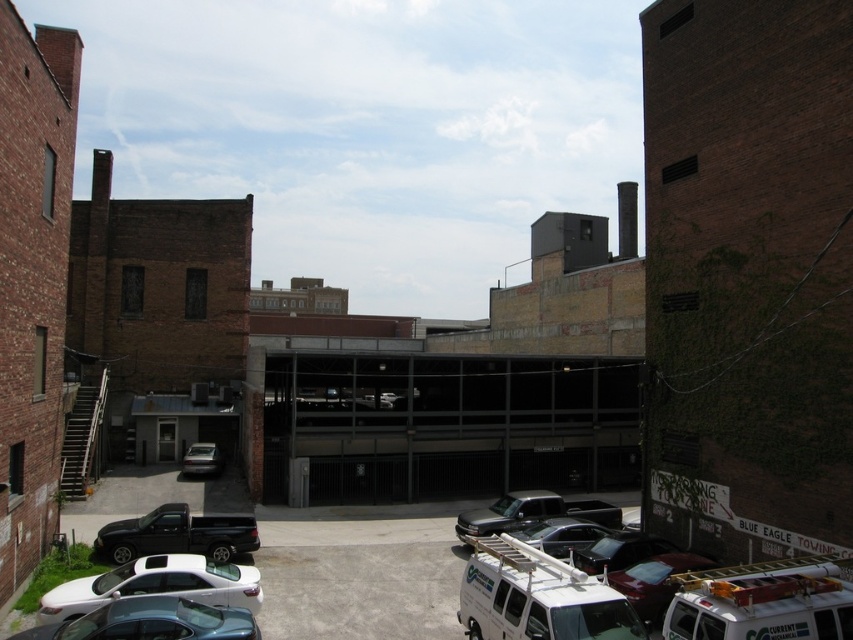
Question: Which object appears closest to the camera in this image?

Choices:
 (A) matte black truck at center
 (B) shiny black car at center
 (C) white matte sedan at lower left
 (D) white plastic ladder at lower right

Answer: (D)

Question: Can you confirm if teal glossy sedan at lower left is positioned below metallic silver car at center?

Choices:
 (A) no
 (B) yes

Answer: (A)

Question: Is dark gray concrete parking garage at center to the right of shiny black car at center from the viewer's perspective?

Choices:
 (A) no
 (B) yes

Answer: (A)

Question: Which object is positioned farthest from the dark gray concrete parking garage at center?

Choices:
 (A) metallic silver car at center
 (B) shiny black truck at lower left
 (C) white matte sedan at lower left

Answer: (C)

Question: Estimate the real-world distances between objects in this image. Which object is closer to the shiny black car at center?

Choices:
 (A) dark gray concrete parking garage at center
 (B) shiny black truck at lower left
 (C) white matte sedan at lower left

Answer: (C)

Question: Can you confirm if white matte sedan at lower left is positioned to the left of shiny black car at center?

Choices:
 (A) yes
 (B) no

Answer: (A)